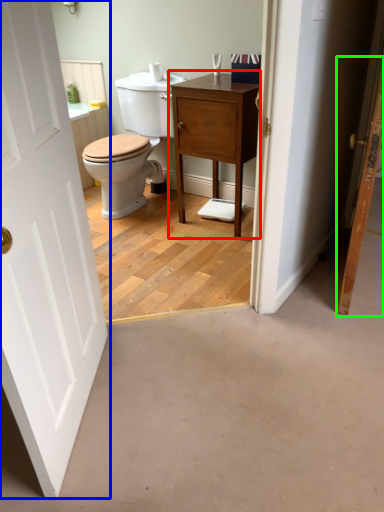
Question: Which object is positioned farthest from nightstand (highlighted by a red box)? Select from door (highlighted by a blue box) and door (highlighted by a green box).

Choices:
 (A) door
 (B) door

Answer: (A)